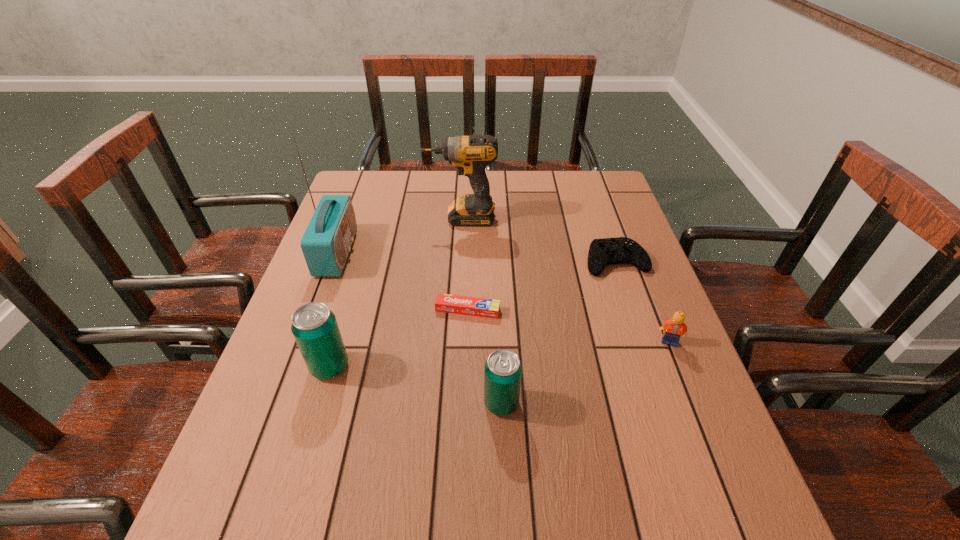
This screenshot has height=540, width=960. What are the coordinates of `the fourth farthest object` in the screenshot? It's located at (472, 306).

Where is `toothpaste`? This screenshot has height=540, width=960. toothpaste is located at coordinates (472, 306).

What are the coordinates of `vacant space located on the front of the fifth shortest object` in the screenshot? It's located at (298, 474).

Locate an element on the screen. This screenshot has height=540, width=960. free space located on the right of the nearer beer can is located at coordinates (681, 403).

Where is `vacant space situated 0.230m with the drill bit of the farthest object facing forward`? vacant space situated 0.230m with the drill bit of the farthest object facing forward is located at coordinates (351, 218).

What are the coordinates of `vacant space located 0.090m with the drill bit of the farthest object facing forward` in the screenshot? It's located at (396, 218).

Identify the location of vacant space located with the drill bit of the farthest object facing forward. The width and height of the screenshot is (960, 540). (384, 218).

Locate an element on the screen. This screenshot has height=540, width=960. free space located 0.060m on the front-facing side of the fifth tallest object is located at coordinates (680, 369).

You are a GUI agent. You are given a task and a screenshot of the screen. Output one action in this format:
    pyautogui.click(x=<x>, y=<y>)
    Task: Click on the vacant space located on the front panel of the tallest object
    Image resolution: width=960 pixels, height=540 pixels.
    Given the screenshot: What is the action you would take?
    pyautogui.click(x=428, y=252)

The width and height of the screenshot is (960, 540). I want to click on vacant space located on the front of the second shortest object, so click(633, 312).